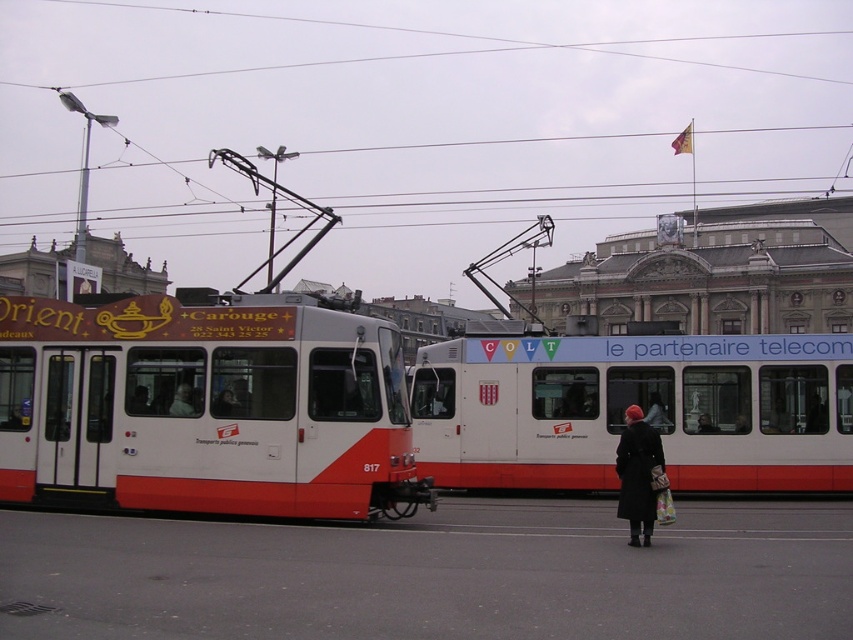
You are standing at the point labeled point (73, 365) and want to take a photo of the trams in the street scene. If your camera is 13.37 meters away from this point, will you be able to capture both trams in the frame without moving?

Yes, since the camera is exactly 13.37 meters away from point (73, 365), which is the required distance to capture both trams in the frame.

You are a delivery person trying to navigate through the street scene. You have a package that requires passing between the white glossy tram at center and the black wool coat at lower right. The package requires a minimum of 1 meter of space to move through. Can you safely pass with your package?

The white glossy tram at center is wider than the black wool coat at lower right. Since the tram is wider, the space between them might be sufficient for your package requiring 1 meter. However, without exact distance measurement, it is uncertain. Please check the actual space available before proceeding.

You are a pedestrian standing on the street and see the white glossy tram at center and the dark brown leather coat at center. Which object is higher in the scene?

The white glossy tram at center is above the dark brown leather coat at center, so the tram is higher.